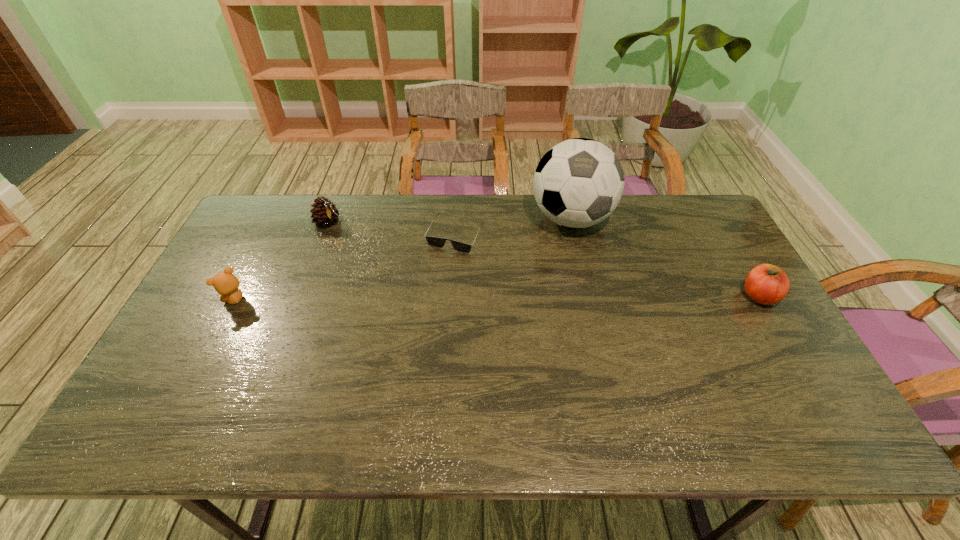
Where is `teddy bear`? teddy bear is located at coordinates tap(225, 283).

Image resolution: width=960 pixels, height=540 pixels. I want to click on apple, so click(767, 284).

This screenshot has width=960, height=540. In order to click on the shortest object in this screenshot , I will do `click(436, 242)`.

Where is `the third object from right to left`? the third object from right to left is located at coordinates (436, 242).

The image size is (960, 540). I want to click on the second object from left to right, so click(x=325, y=213).

In order to click on soccer ball in this screenshot , I will do `click(578, 183)`.

I want to click on the tallest object, so click(578, 183).

In order to click on vacant space situated on the left of the rightmost object in this screenshot , I will do `click(666, 296)`.

Image resolution: width=960 pixels, height=540 pixels. I want to click on free spot located 0.120m on the front-facing side of the sunglasses, so click(433, 280).

In order to click on vacant space located on the front-facing side of the sunglasses in this screenshot , I will do `click(428, 290)`.